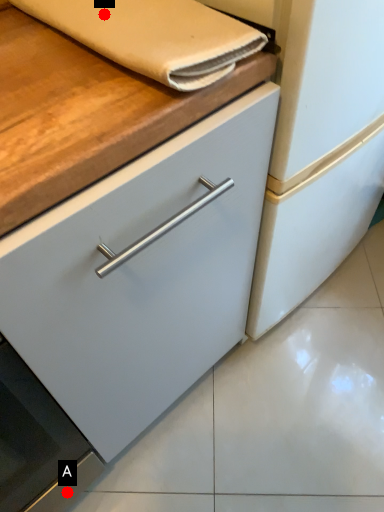
Question: Two points are circled on the image, labeled by A and B beside each circle. Which point appears farthest from the camera in this image?

Choices:
 (A) A is further
 (B) B is further

Answer: (A)